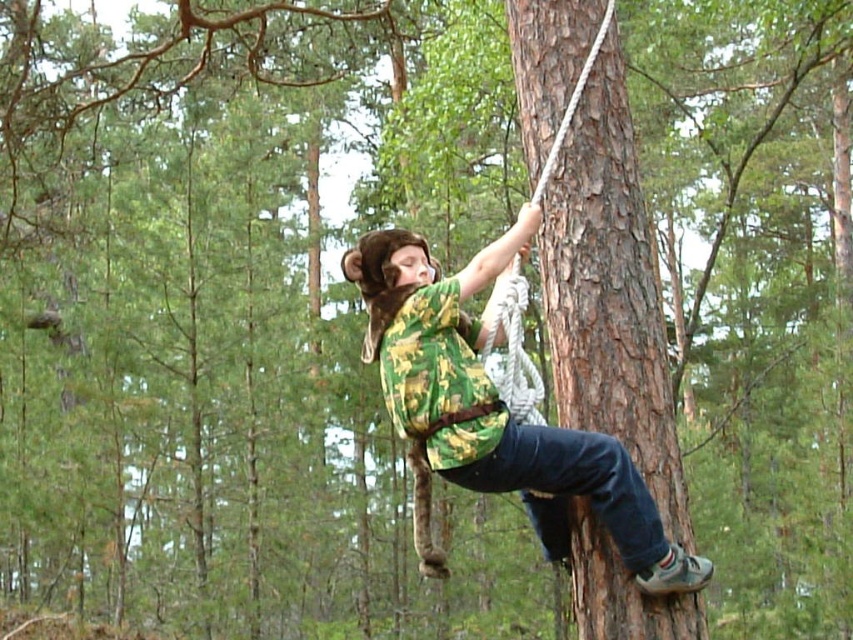
You are a photographer standing at the camera position. You want to take a photo of the brown rough tree trunk at center. If your camera has a maximum focus range of 4 meters, will you be able to capture the tree trunk clearly?

The brown rough tree trunk at center and camera are 4.63 meters apart. Since the distance exceeds the camera maximum focus range of 4 meters, you will not be able to capture the tree trunk clearly.

You are a photographer trying to capture the scene of the tree climber. You need to ensure the brown rough tree trunk at center and the camouflage fabric shirt at center are both in focus. Which object should you adjust your camera focus on first to account for their sizes?

The camouflage fabric shirt at center is wider than the brown rough tree trunk at center, so you should focus on the camouflage fabric shirt at center first to ensure proper framing and focus.

You are a photographer trying to capture a photo of the brown rough tree trunk at center and the camouflage fabric shirt at center. Which object should you focus on first if you want to ensure both are in focus?

The camouflage fabric shirt at center is lower than the brown rough tree trunk at center, so you should focus on the camouflage fabric shirt at center first to ensure both are in focus.